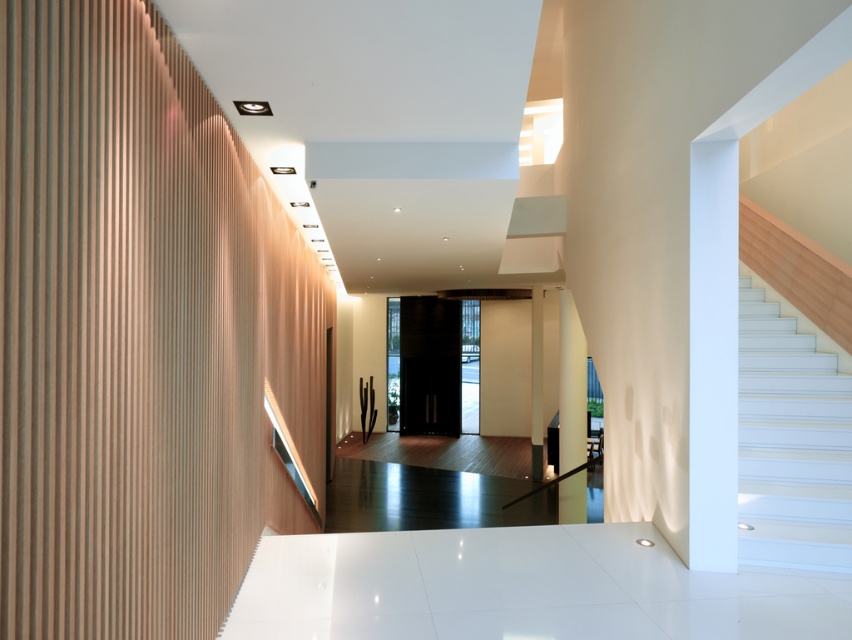
From the picture: You are standing in the modern architectural space described. There are two points marked in the scene. The first point is at coordinates point (752, 342) and the second is at point (562, 424). Which of these two points is closer to your current position?

Point (752, 342) is closer to the viewer than point (562, 424).

You are standing at the entrance of the space and want to reach the upper floor. The white glossy pillar at center is blocking your direct path. Which object should you navigate around to reach the white glossy stairs at right?

You should navigate around the white glossy pillar at center to reach the white glossy stairs at right since the stairs are positioned to the right of the pillar.